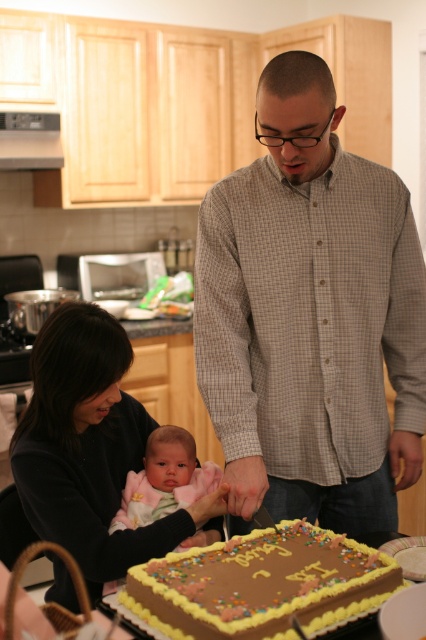
Question: Can you confirm if matte black sweater at lower left is positioned below chocolate frosted cake at center?

Choices:
 (A) yes
 (B) no

Answer: (B)

Question: Among these points, which one is farthest from the camera?

Choices:
 (A) (359, 596)
 (B) (250, 468)

Answer: (B)

Question: Which point appears farthest from the camera in this image?

Choices:
 (A) (181, 506)
 (B) (236, 609)
 (C) (353, 284)
 (D) (77, 428)

Answer: (A)

Question: Based on their relative distances, which object is farther from the matte black sweater at lower left?

Choices:
 (A) chocolate frosted cake at center
 (B) pink fleece baby at center
 (C) checkered shirt at center

Answer: (A)

Question: Is checkered shirt at center to the right of chocolate frosted cake at center from the viewer's perspective?

Choices:
 (A) no
 (B) yes

Answer: (B)

Question: From the image, what is the correct spatial relationship of checkered shirt at center in relation to pink fleece baby at center?

Choices:
 (A) right
 (B) left

Answer: (A)